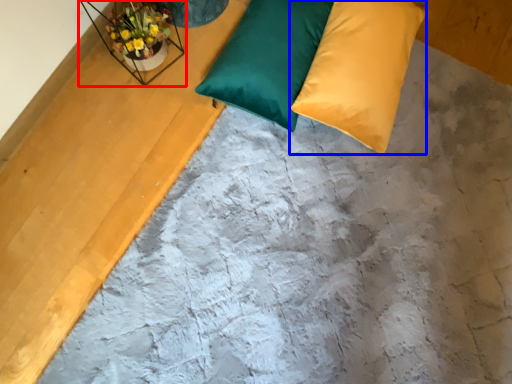
Question: Which of the following is the closest to the observer, window sill (highlighted by a red box) or pillow (highlighted by a blue box)?

Choices:
 (A) window sill
 (B) pillow

Answer: (A)